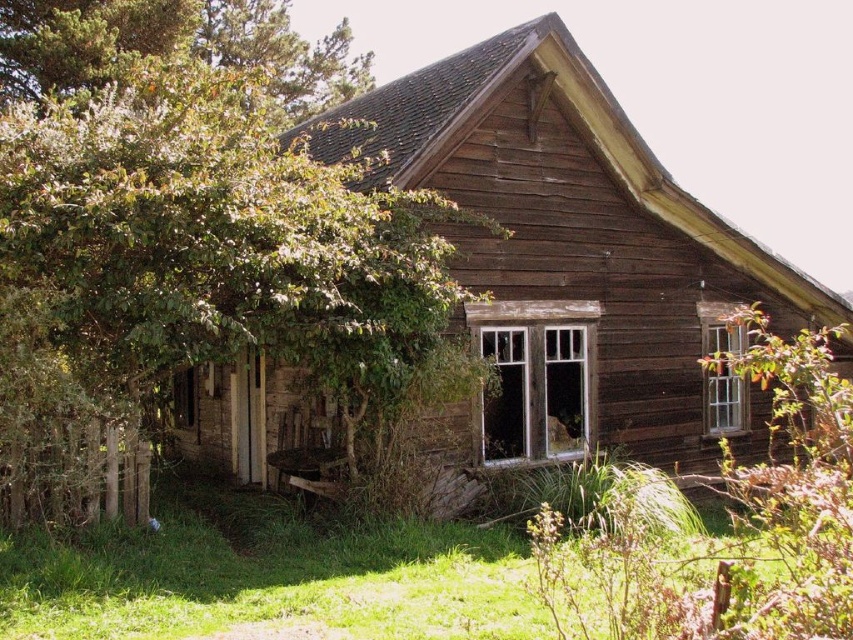
Question: Among these points, which one is nearest to the camera?

Choices:
 (A) [x=103, y=612]
 (B) [x=653, y=340]

Answer: (A)

Question: Is green leafy tree at upper left positioned before weathered wood cabin at center?

Choices:
 (A) no
 (B) yes

Answer: (B)

Question: Which of these objects is positioned farthest from the green grass at lower center?

Choices:
 (A) weathered wood cabin at center
 (B) green leafy tree at upper left

Answer: (B)

Question: Is green leafy tree at upper left positioned behind green grass at lower center?

Choices:
 (A) yes
 (B) no

Answer: (A)

Question: Does weathered wood cabin at center appear on the right side of green grass at lower center?

Choices:
 (A) yes
 (B) no

Answer: (A)

Question: Which object is positioned closest to the green grass at lower center?

Choices:
 (A) green leafy tree at upper left
 (B) weathered wood cabin at center

Answer: (B)